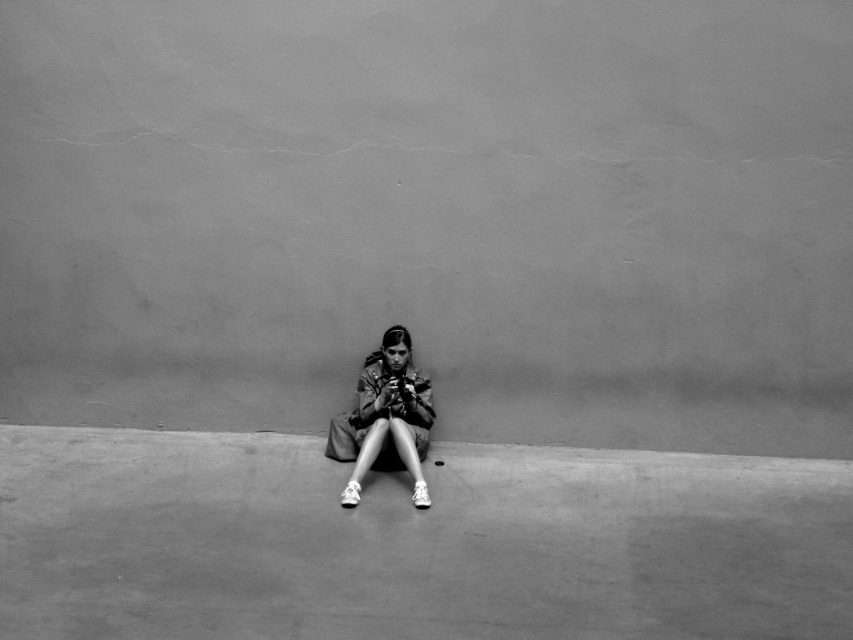
Describe the element at coordinates (413, 541) in the screenshot. I see `smooth concrete at center` at that location.

Who is higher up, smooth concrete at center or matte brown jacket at center?

matte brown jacket at center is higher up.

At what (x,y) coordinates should I click in order to perform the action: click on smooth concrete at center. Please return your answer as a coordinate pair (x, y). Looking at the image, I should click on pyautogui.click(x=413, y=541).

Identify the location of smooth concrete at center. This screenshot has height=640, width=853. (413, 541).